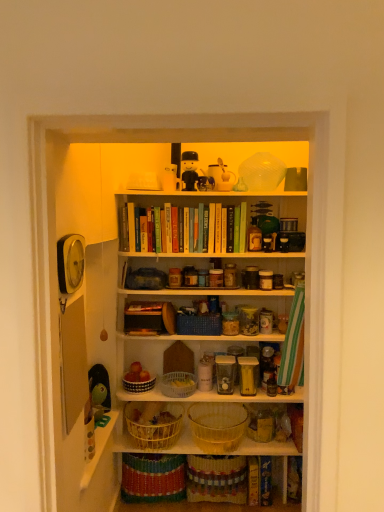
Question: Which direction should I rotate to look at matte plastic figurine at upper center, which is counted as the 2th toy, starting from the bottom?

Choices:
 (A) right
 (B) left

Answer: (A)

Question: Does green rubber duck at left, positioned as the fourth toy in top-to-bottom order, come behind woven yellow basket at center, placed as the fourth basket when sorted from top to bottom?

Choices:
 (A) yes
 (B) no

Answer: (A)

Question: Is green rubber duck at left, placed as the 4th toy when sorted from right to left, smaller than woven yellow basket at center, the 2th basket when ordered from bottom to top?

Choices:
 (A) yes
 (B) no

Answer: (A)

Question: From a real-world perspective, does green rubber duck at left, placed as the 4th toy when sorted from right to left, stand above woven yellow basket at center, placed as the fourth basket when sorted from top to bottom?

Choices:
 (A) no
 (B) yes

Answer: (B)

Question: Is green rubber duck at left, placed as the 4th toy when sorted from right to left, facing towards woven yellow basket at center, the 2th basket when ordered from bottom to top?

Choices:
 (A) no
 (B) yes

Answer: (B)

Question: From the image's perspective, would you say green rubber duck at left, which appears as the 1th toy when ordered from the bottom, is shown under woven yellow basket at center, placed as the fourth basket when sorted from top to bottom?

Choices:
 (A) no
 (B) yes

Answer: (A)

Question: Is green rubber duck at left, which appears as the 1th toy when ordered from the bottom, taller than woven yellow basket at center, placed as the fourth basket when sorted from top to bottom?

Choices:
 (A) no
 (B) yes

Answer: (B)

Question: Is white woven basket at lower center, the 4th basket positioned from the bottom, oriented towards clear plastic basket at center, the third basket ordered from the bottom?

Choices:
 (A) no
 (B) yes

Answer: (A)

Question: From a real-world perspective, does white woven basket at lower center, the 2th basket when ordered from top to bottom, sit lower than clear plastic basket at center, the 3th basket in the top-to-bottom sequence?

Choices:
 (A) yes
 (B) no

Answer: (B)

Question: Is white woven basket at lower center, the 2th basket when ordered from top to bottom, surrounding clear plastic basket at center, the third basket ordered from the bottom?

Choices:
 (A) no
 (B) yes

Answer: (A)

Question: Is white woven basket at lower center, the 4th basket positioned from the bottom, shorter than clear plastic basket at center, the 3th basket in the top-to-bottom sequence?

Choices:
 (A) no
 (B) yes

Answer: (B)

Question: Does white woven basket at lower center, the 2th basket when ordered from top to bottom, have a greater height compared to clear plastic basket at center, the third basket ordered from the bottom?

Choices:
 (A) yes
 (B) no

Answer: (B)

Question: Does white woven basket at lower center, the 4th basket positioned from the bottom, appear on the right side of clear plastic basket at center, the 3th basket in the top-to-bottom sequence?

Choices:
 (A) no
 (B) yes

Answer: (A)

Question: Is the surface of white woven basket at lower center, the 4th basket positioned from the bottom, in direct contact with black plastic toy at upper center, which is counted as the 1th toy, starting from the top?

Choices:
 (A) yes
 (B) no

Answer: (B)